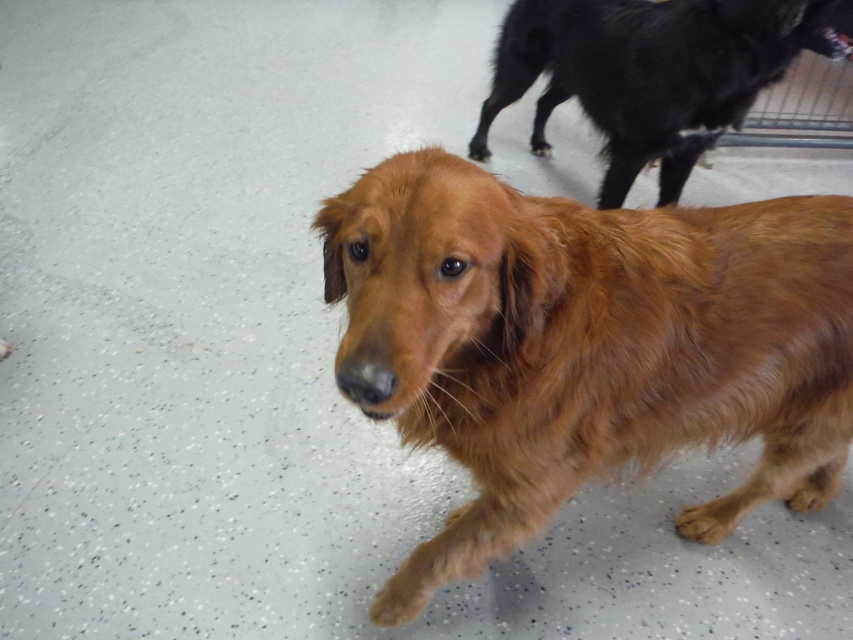
You are a photographer setting up a camera to capture both the shiny golden fur dog at center and the shiny black dog at upper right. The camera has a fixed width of 2 meters. Can you fit both dogs in the frame without moving the camera?

The shiny golden fur dog at center is wider than the shiny black dog at upper right. Since the camera has a fixed width of 2 meters, you need to ensure the combined width of both dogs does not exceed this. However, the exact combined width isn

Looking at this image, you are standing at the origin point of the image. You see a shiny golden fur dog at center located at point (585, 346). Can you determine if the shiny golden fur dog at center is closer to you or further away compared to the black dog in the background?

The shiny golden fur dog at center is closer to you than the black dog in the background because it is in the foreground.